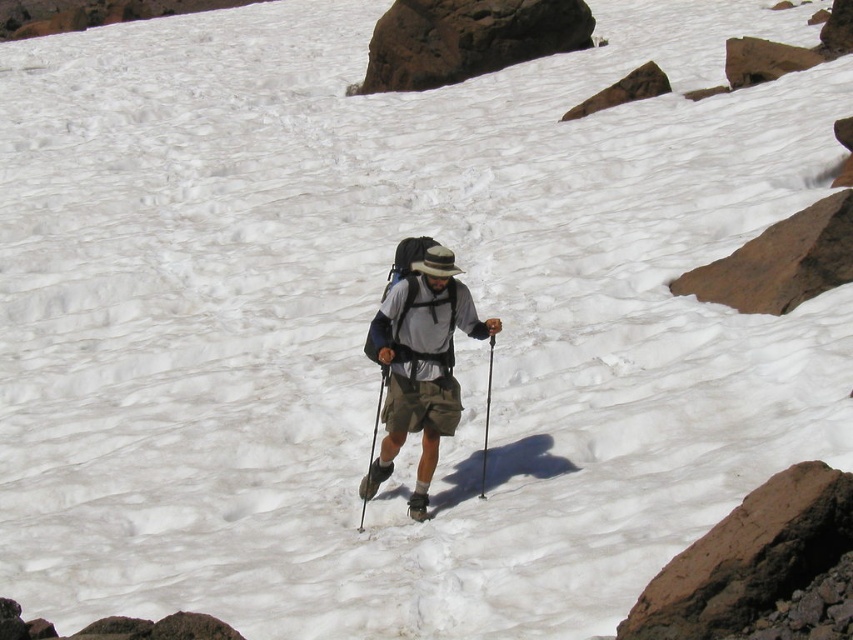
Question: Which point is closer to the camera?

Choices:
 (A) (625, 637)
 (B) (827, 288)

Answer: (A)

Question: Is brown rough rock at lower right smaller than brown rock at upper right?

Choices:
 (A) yes
 (B) no

Answer: (A)

Question: Considering the relative positions of brown rough rock at upper center and black plastic ski pole at center in the image provided, where is brown rough rock at upper center located with respect to black plastic ski pole at center?

Choices:
 (A) right
 (B) left

Answer: (A)

Question: Which object appears closest to the camera in this image?

Choices:
 (A) black plastic ski pole at center
 (B) brown rough rock at lower right
 (C) brown rock at upper right
 (D) metallic silver ski pole at center

Answer: (B)

Question: Which point is closer to the camera?

Choices:
 (A) black plastic ski pole at center
 (B) metallic silver ski pole at center
 (C) brown rough rock at lower right
 (D) brown rough rock at upper center

Answer: (C)

Question: Does metallic silver ski pole at center have a smaller size compared to black plastic ski pole at center?

Choices:
 (A) yes
 (B) no

Answer: (A)